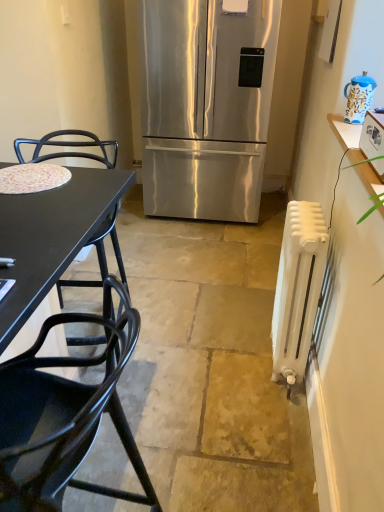
I want to click on spots to the right of black metal chair at left, the first chair positioned from the back, so click(x=184, y=339).